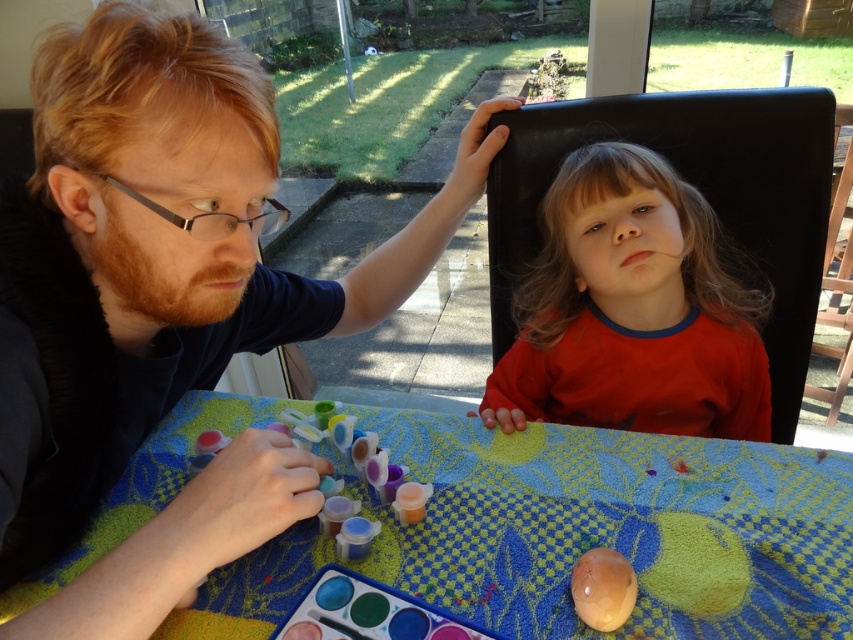
Question: Among these points, which one is farthest from the camera?

Choices:
 (A) (570, 420)
 (B) (140, 77)
 (C) (180, 624)

Answer: (A)

Question: Which of the following is the farthest from the observer?

Choices:
 (A) red matte shirt at upper center
 (B) matte black shirt at upper left
 (C) matte brown egg at lower center

Answer: (A)

Question: Based on their relative distances, which object is farther from the matte plastic table at center?

Choices:
 (A) red matte shirt at upper center
 (B) matte brown egg at lower center

Answer: (A)

Question: Does matte plastic table at center have a greater width compared to red matte shirt at upper center?

Choices:
 (A) yes
 (B) no

Answer: (A)

Question: Is matte plastic table at center wider than red matte shirt at upper center?

Choices:
 (A) yes
 (B) no

Answer: (A)

Question: Can you confirm if red matte shirt at upper center is positioned below matte brown egg at lower center?

Choices:
 (A) no
 (B) yes

Answer: (A)